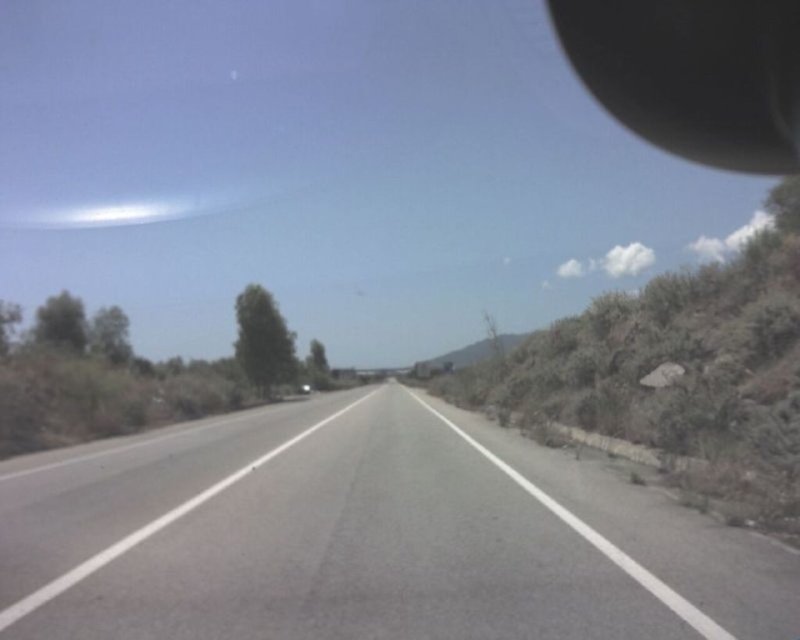
Between point (136, 568) and point (708, 157), which one is positioned in front?

Positioned in front is point (136, 568).

Does asphalt road at center have a smaller size compared to black rubber rearview mirror at upper right?

Yes, asphalt road at center is smaller than black rubber rearview mirror at upper right.

This screenshot has height=640, width=800. I want to click on asphalt road at center, so click(368, 538).

What are the coordinates of `asphalt road at center` in the screenshot? It's located at (368, 538).